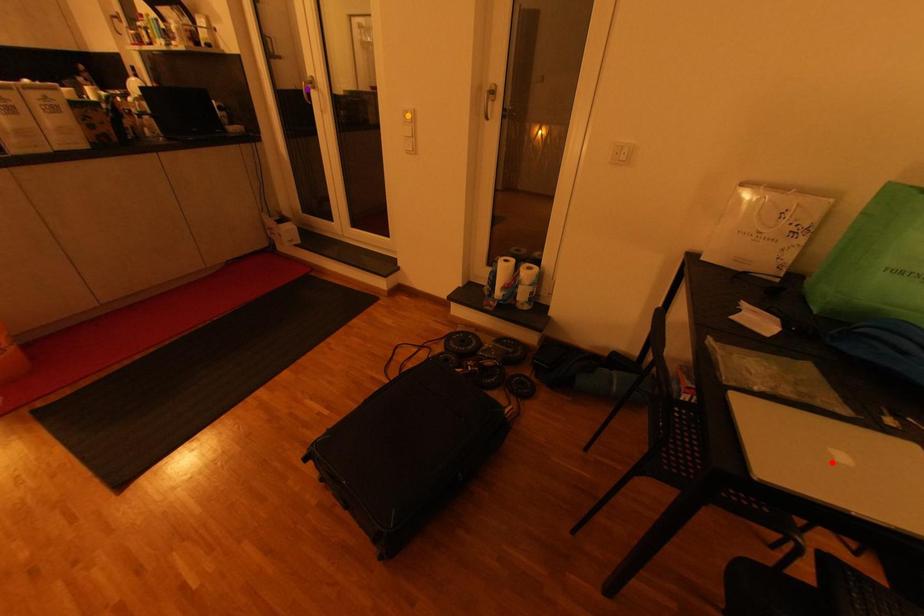
Order these from nearest to farthest:
- orange point
- red point
- purple point

red point, orange point, purple point